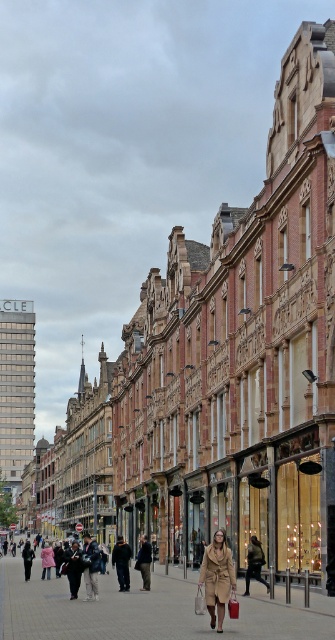
You are a delivery person who needs to hand over a package to the owner of the camel wool coat at center and the matte beige shopping bag at center. Since you can only approach one at a time, which object should you approach first if you want to reach the one closer to the left side of the scene?

The matte beige shopping bag at center is closer to the left side of the scene than the camel wool coat at center, so you should approach the matte beige shopping bag at center first.

You are a delivery person standing on the sidewalk in this busy street scene. You need to place a package between the camel wool coat at center and the matte beige shopping bag at center. The package is 3 feet long. Can you fit it between them without moving either item?

The camel wool coat at center and matte beige shopping bag at center are 4.55 feet apart from each other. Since the package is 3 feet long, which is shorter than the 4.55 feet gap, you can fit it between them without moving either item.

You are a delivery person trying to place a large package on the ground in the middle of the street. The package is the size of the camel wool coat at center. Can you fit it on the brick pavement at center without overlapping the edges?

The brick pavement at center has a larger size compared to the camel wool coat at center, so the package can fit on the brick pavement at center without overlapping the edges.